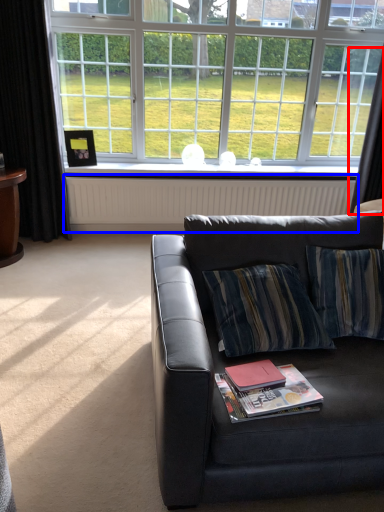
Question: Among these objects, which one is nearest to the camera, curtain (highlighted by a red box) or radiator (highlighted by a blue box)?

Choices:
 (A) curtain
 (B) radiator

Answer: (A)